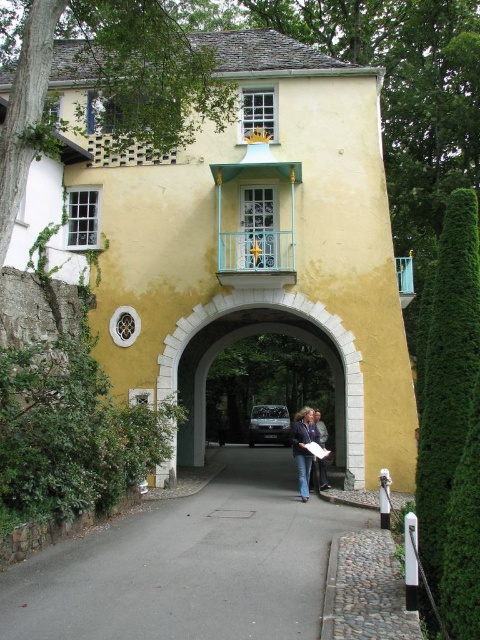
Based on the photo, you are a gardener standing in front of the yellow building and need to trim both the green leafy hedge at right and the dark blue jeans at center. Which object should you tackle first if you want to start with the taller one?

The green leafy hedge at right is taller than the dark blue jeans at center, so you should start by trimming the green leafy hedge at right first.

You are standing in front of the yellow building and want to walk towards the dark blue jeans at center. Which direction should you turn to avoid the green leafy hedge at right?

The green leafy hedge at right is to the right of dark blue jeans at center, so you should turn left to avoid it and head towards the dark blue jeans at center.

You are a gardener planning to trim the green leafy hedge at right and the white stone archway at center. Which object requires more attention in terms of size?

The green leafy hedge at right is bigger than the white stone archway at center, so it requires more attention in terms of size.